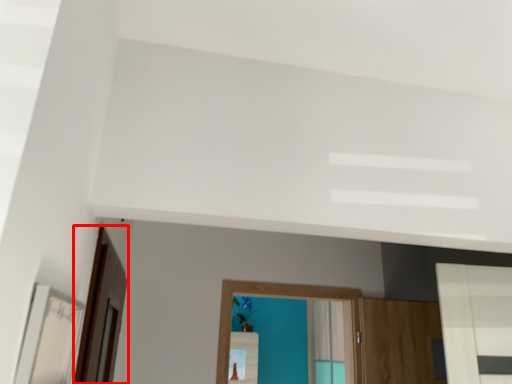
Question: From the image, what is the correct spatial relationship of screen door (annotated by the red box) in relation to mirror?

Choices:
 (A) left
 (B) right

Answer: (A)